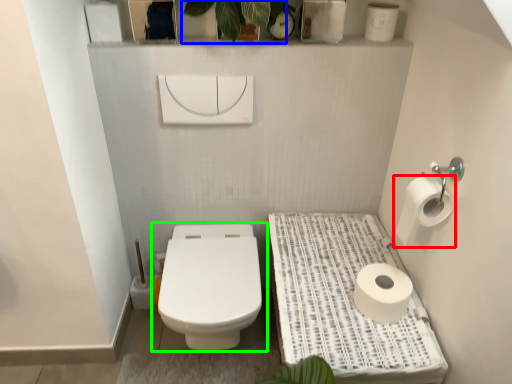
Question: Estimate the real-world distances between objects in this image. Which object is farther from toilet paper (highlighted by a red box), plant (highlighted by a blue box) or toilet (highlighted by a green box)?

Choices:
 (A) plant
 (B) toilet

Answer: (A)